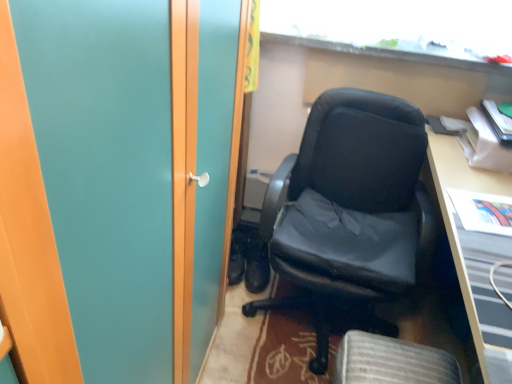
Question: Is wooden desk at right completely or partially inside black leather shoes at center, which ranks as the 1th footwear in left-to-right order?

Choices:
 (A) no
 (B) yes

Answer: (A)

Question: Considering the relative sizes of black leather shoes at center, which ranks as the 1th footwear in left-to-right order, and wooden desk at right in the image provided, is black leather shoes at center, which ranks as the 1th footwear in left-to-right order, taller than wooden desk at right?

Choices:
 (A) no
 (B) yes

Answer: (A)

Question: From a real-world perspective, is black leather shoes at center, the 2th footwear when ordered from right to left, over wooden desk at right?

Choices:
 (A) yes
 (B) no

Answer: (B)

Question: Considering the relative sizes of black leather shoes at center, which ranks as the 1th footwear in left-to-right order, and wooden desk at right in the image provided, is black leather shoes at center, which ranks as the 1th footwear in left-to-right order, smaller than wooden desk at right?

Choices:
 (A) yes
 (B) no

Answer: (A)

Question: Is black leather shoes at center, which ranks as the 1th footwear in left-to-right order, wider or thinner than black leather chair at center?

Choices:
 (A) wide
 (B) thin

Answer: (B)

Question: Considering the positions of point (241, 230) and point (361, 172), is point (241, 230) closer or farther from the camera than point (361, 172)?

Choices:
 (A) farther
 (B) closer

Answer: (A)

Question: Would you say black leather shoes at center, which ranks as the 1th footwear in left-to-right order, is to the left or to the right of black leather chair at center in the picture?

Choices:
 (A) left
 (B) right

Answer: (A)

Question: From the image's perspective, is black leather shoes at center, which ranks as the 1th footwear in left-to-right order, located above or below black leather chair at center?

Choices:
 (A) above
 (B) below

Answer: (B)

Question: Is black leather chair at center taller or shorter than black leather shoes at center, which ranks as the second footwear in left-to-right order?

Choices:
 (A) short
 (B) tall

Answer: (B)

Question: Is point (400, 291) closer or farther from the camera than point (256, 238)?

Choices:
 (A) farther
 (B) closer

Answer: (B)

Question: Considering the positions of black leather chair at center and black leather shoes at center, marked as the 1th footwear in a right-to-left arrangement, in the image, is black leather chair at center wider or thinner than black leather shoes at center, marked as the 1th footwear in a right-to-left arrangement,?

Choices:
 (A) wide
 (B) thin

Answer: (A)

Question: Looking at the image, does black leather chair at center seem bigger or smaller compared to black leather shoes at center, which ranks as the second footwear in left-to-right order?

Choices:
 (A) big
 (B) small

Answer: (A)

Question: Considering the positions of black leather shoes at center, which ranks as the 1th footwear in left-to-right order, and wooden desk at right in the image, is black leather shoes at center, which ranks as the 1th footwear in left-to-right order, taller or shorter than wooden desk at right?

Choices:
 (A) short
 (B) tall

Answer: (A)

Question: Is black leather shoes at center, the 2th footwear when ordered from right to left, in front of or behind wooden desk at right in the image?

Choices:
 (A) front
 (B) behind

Answer: (B)